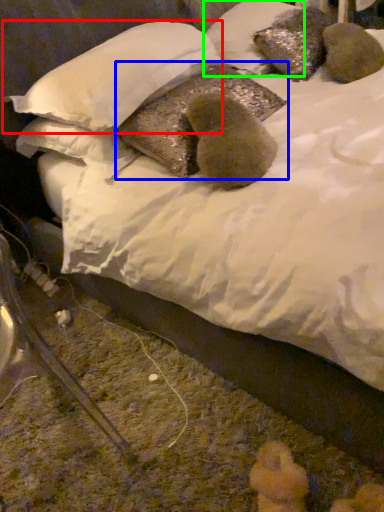
Question: Which object is the farthest from pillow (highlighted by a red box)? Choose among these: pillow (highlighted by a blue box) or pillow (highlighted by a green box).

Choices:
 (A) pillow
 (B) pillow

Answer: (B)